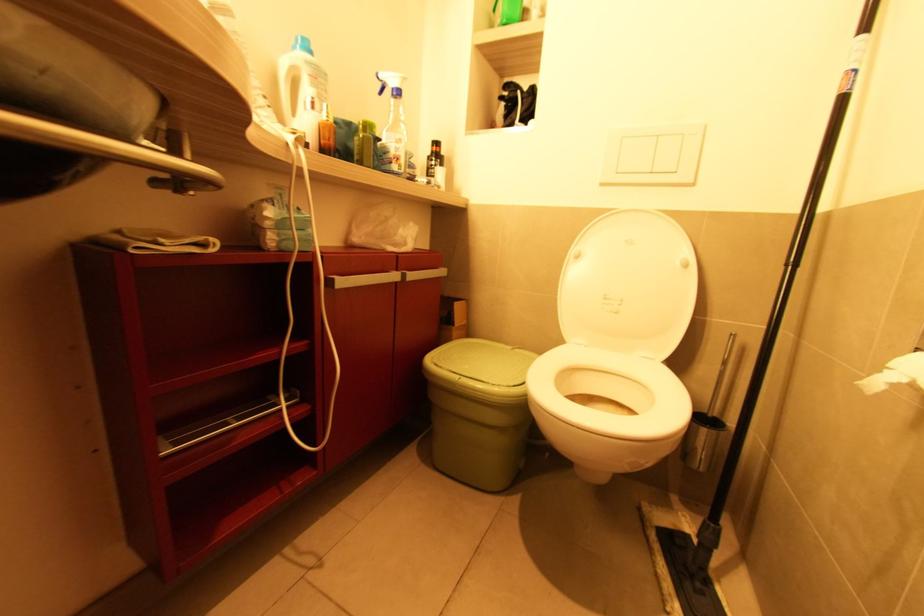
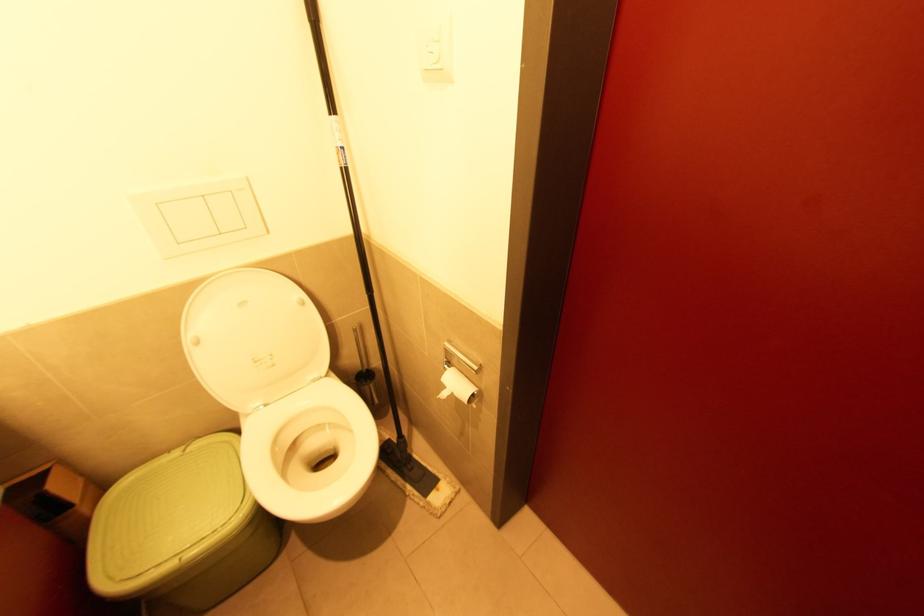
Find the pixel in the second image that matches point 579,257 in the first image.

(200, 342)